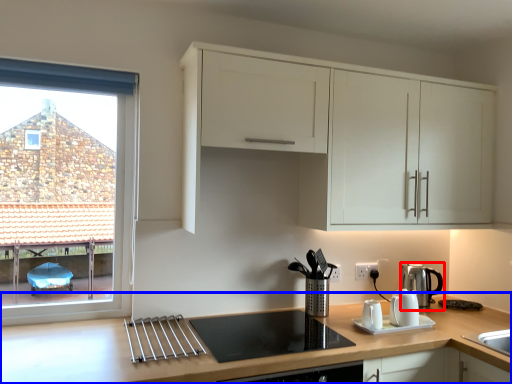
Question: Which point is closer to the camera, kitchen appliance (highlighted by a red box) or countertop (highlighted by a blue box)?

Choices:
 (A) kitchen appliance
 (B) countertop

Answer: (B)